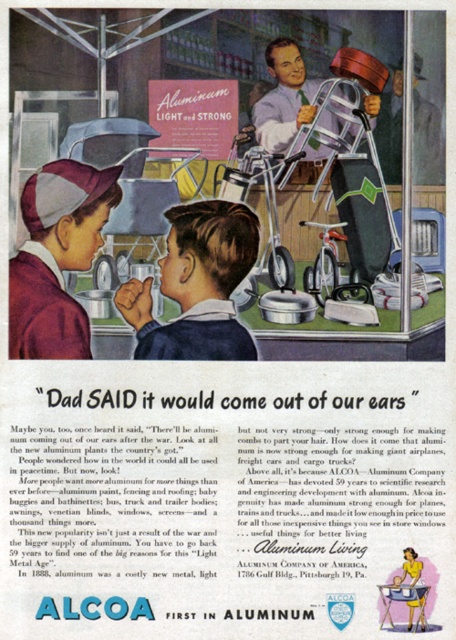
Question: Which point appears farthest from the camera in this image?

Choices:
 (A) (426, 173)
 (B) (372, 99)
 (C) (74, 188)
 (D) (166, 276)

Answer: (B)

Question: Is dark brown hair at center bigger than matte aluminum helmet at upper center?

Choices:
 (A) yes
 (B) no

Answer: (A)

Question: Among these points, which one is nearest to the camera?

Choices:
 (A) (423, 113)
 (B) (71, 193)
 (C) (366, 106)
 (D) (222, 317)

Answer: (D)

Question: Is maroon fabric baseball cap at center-left to the left of matte aluminum bicycle at upper center from the viewer's perspective?

Choices:
 (A) no
 (B) yes

Answer: (B)

Question: Which of the following is the farthest from the observer?

Choices:
 (A) (290, 67)
 (B) (58, 296)
 (C) (243, 211)

Answer: (A)

Question: Can you confirm if matte aluminum helmet at upper center is positioned above matte aluminum bicycle at upper center?

Choices:
 (A) no
 (B) yes

Answer: (B)